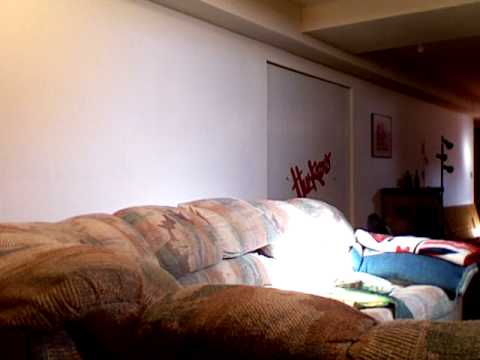
At what (x,y) coordinates should I click in order to perform the action: click on logo on wall. Please return your answer as a coordinate pair (x, y). Image resolution: width=480 pixels, height=360 pixels. Looking at the image, I should click on (312, 180).